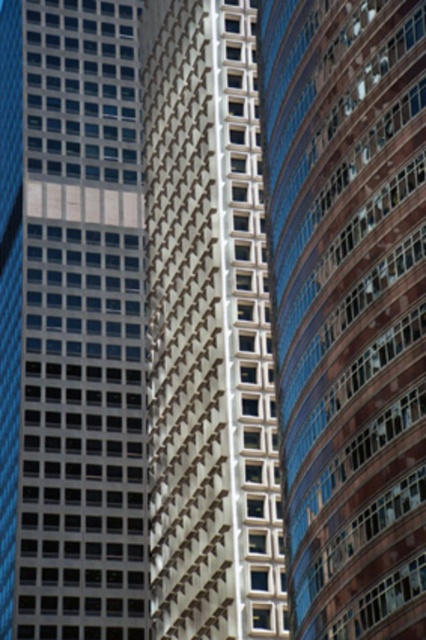
Between point (373, 436) and point (20, 332), which one is positioned in front?

Positioned in front is point (373, 436).

Where is `smooth glass skyscraper at center`? The image size is (426, 640). smooth glass skyscraper at center is located at coordinates (348, 305).

Is point (11, 112) in front of point (154, 120)?

No, it is not.

Which is above, matte glass skyscraper at center or white textured building at center?

matte glass skyscraper at center

Is point (13, 573) positioned in front of point (230, 186)?

No, it is not.

Identify the location of matte glass skyscraper at center. (71, 323).

Can you confirm if smooth glass skyscraper at center is positioned to the right of white textured building at center?

Correct, you'll find smooth glass skyscraper at center to the right of white textured building at center.

How far apart are smooth glass skyscraper at center and white textured building at center?

smooth glass skyscraper at center and white textured building at center are 14.20 meters apart.

Describe the element at coordinates (348, 305) in the screenshot. I see `smooth glass skyscraper at center` at that location.

This screenshot has height=640, width=426. I want to click on smooth glass skyscraper at center, so click(x=348, y=305).